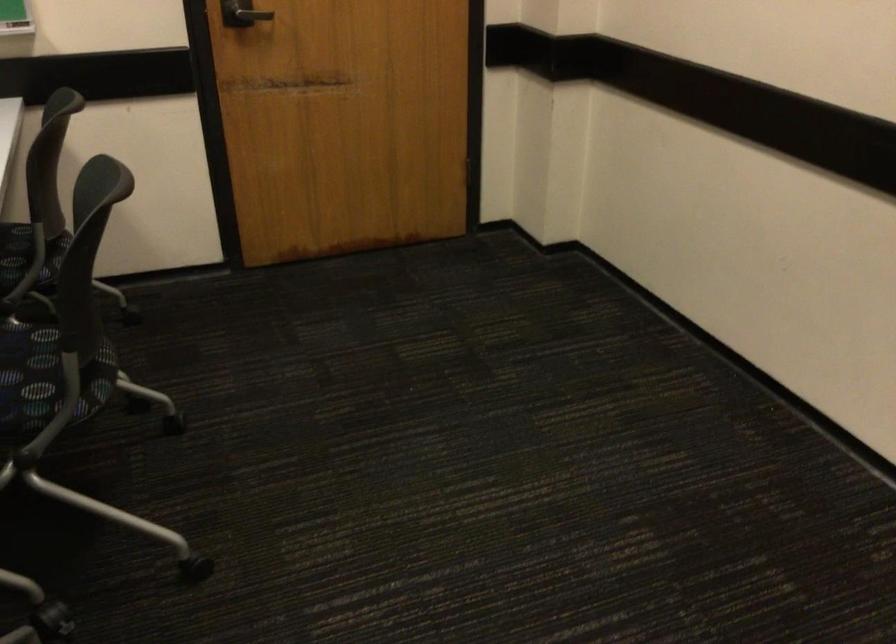
Image resolution: width=896 pixels, height=644 pixels. Find the location of `black door handle`. black door handle is located at coordinates (243, 13).